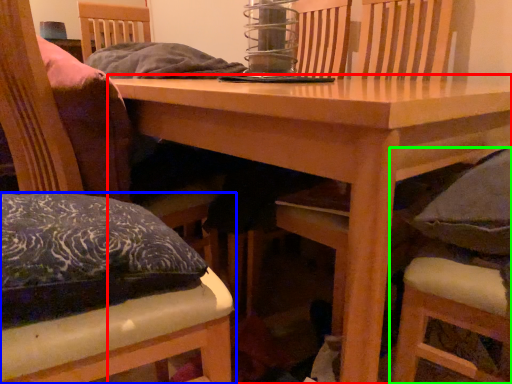
Question: Which object is positioned farthest from table (highlighted by a red box)? Select from chair (highlighted by a blue box) and chair (highlighted by a green box).

Choices:
 (A) chair
 (B) chair

Answer: (A)